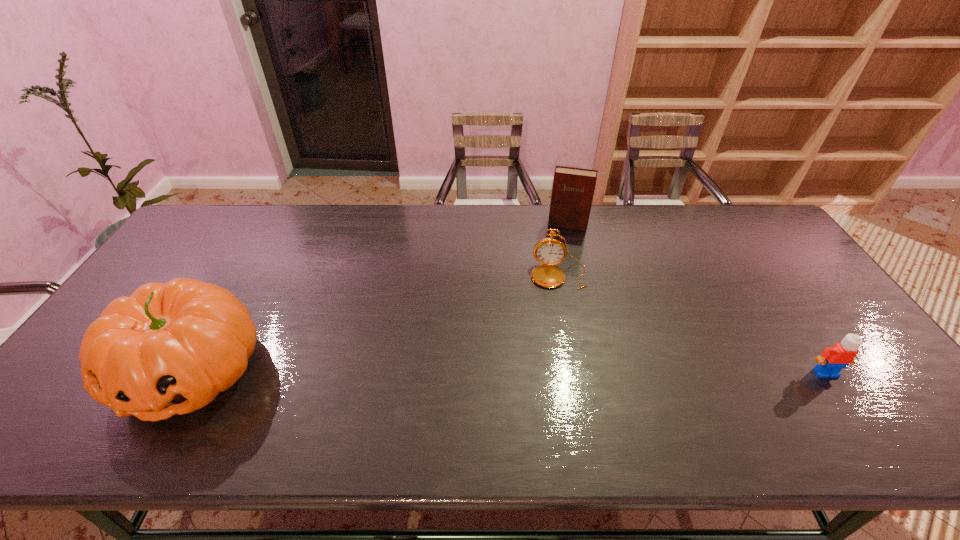
The height and width of the screenshot is (540, 960). What are the coordinates of `free space located 0.070m on the front cover of the diary` in the screenshot? It's located at (563, 243).

Locate an element on the screen. The height and width of the screenshot is (540, 960). free point located 0.090m on the front cover of the diary is located at coordinates (562, 247).

Identify the location of object that is at the far edge. This screenshot has height=540, width=960. pos(573,189).

You are a GUI agent. You are given a task and a screenshot of the screen. Output one action in this format:
    pyautogui.click(x=<x>, y=<y>)
    Task: Click on the pumpkin located in the near edge section of the desktop
    This screenshot has height=540, width=960.
    Given the screenshot: What is the action you would take?
    pyautogui.click(x=170, y=348)

Where is `Lego present at the near edge`? This screenshot has height=540, width=960. Lego present at the near edge is located at coordinates (833, 359).

What are the coordinates of `object situated at the left edge` in the screenshot? It's located at (170, 348).

Image resolution: width=960 pixels, height=540 pixels. In order to click on object present at the right edge in this screenshot , I will do `click(833, 359)`.

This screenshot has width=960, height=540. I want to click on object located at the near left corner, so click(x=170, y=348).

I want to click on object that is at the near right corner, so click(833, 359).

The height and width of the screenshot is (540, 960). I want to click on vacant space at the far edge of the desktop, so click(375, 225).